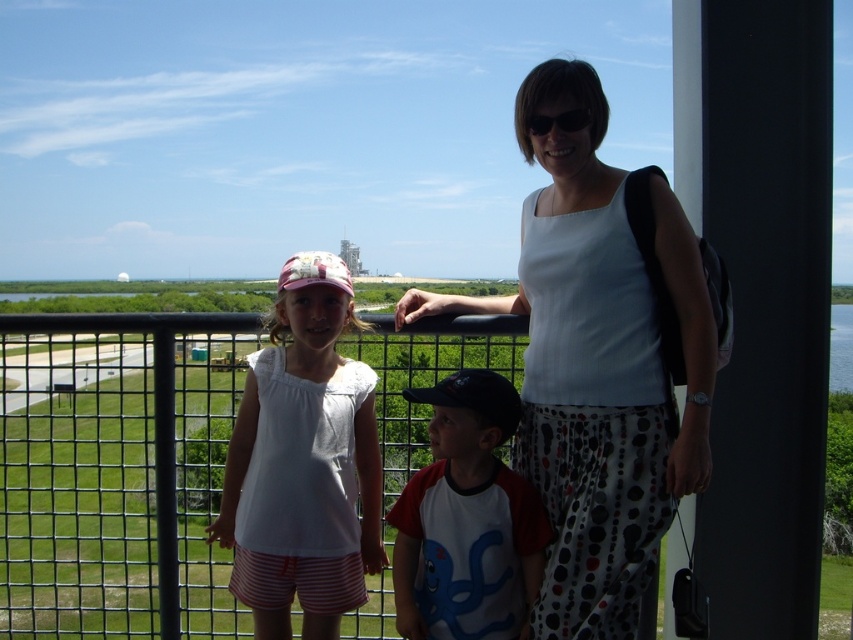
Is white dotted pants at center closer to the viewer compared to red and white jersey at center?

Yes.

Does white dotted pants at center have a smaller size compared to red and white jersey at center?

No.

The width and height of the screenshot is (853, 640). Find the location of `white dotted pants at center`. white dotted pants at center is located at coordinates (601, 356).

Locate an element on the screen. white dotted pants at center is located at coordinates (601, 356).

Is white cotton shirt at center below red and white jersey at center?

No, white cotton shirt at center is not below red and white jersey at center.

Who is taller, white cotton shirt at center or red and white jersey at center?

red and white jersey at center

Which is behind, point (321, 368) or point (425, 474)?

The point (321, 368) is more distant.

At what (x,y) coordinates should I click in order to perform the action: click on white cotton shirt at center. Please return your answer as a coordinate pair (x, y). This screenshot has width=853, height=640. Looking at the image, I should click on (303, 461).

Is point (581, 356) farther from camera compared to point (346, 545)?

No, (581, 356) is in front of (346, 545).

This screenshot has width=853, height=640. What do you see at coordinates (601, 356) in the screenshot?
I see `white dotted pants at center` at bounding box center [601, 356].

What are the coordinates of `white dotted pants at center` in the screenshot? It's located at (601, 356).